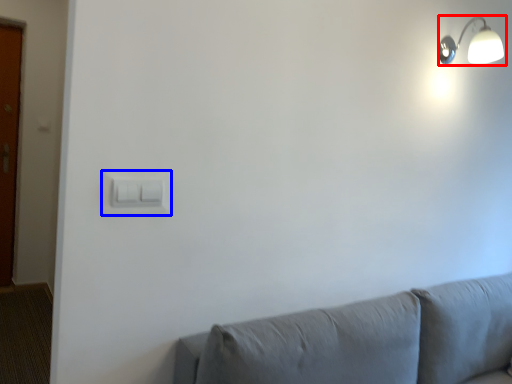
Question: Which of the following is the farthest to the observer, lamp (highlighted by a red box) or light switch (highlighted by a blue box)?

Choices:
 (A) lamp
 (B) light switch

Answer: (A)